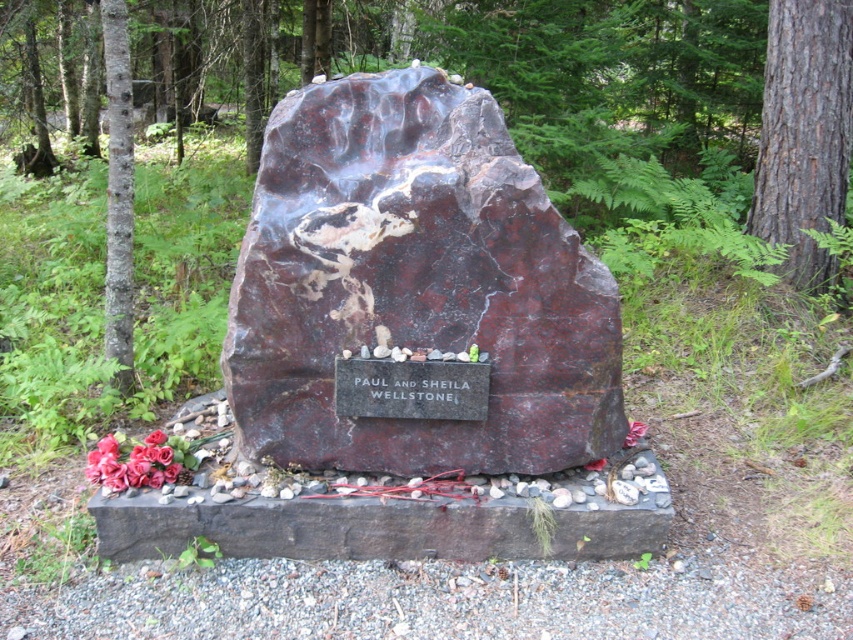
I want to click on marble-like stone at center, so click(415, 285).

What do you see at coordinates (415, 285) in the screenshot? I see `marble-like stone at center` at bounding box center [415, 285].

This screenshot has width=853, height=640. What are the coordinates of `marble-like stone at center` in the screenshot? It's located at (415, 285).

Which of these two, brown rough bark tree at right or brown rough bark tree at left, stands shorter?

brown rough bark tree at left

Consider the image. Is brown rough bark tree at right behind brown rough bark tree at left?

Yes, it is behind brown rough bark tree at left.

Between point (828, 216) and point (120, 108), which one is positioned in front?

Point (120, 108)

Locate an element on the screen. Image resolution: width=853 pixels, height=640 pixels. brown rough bark tree at right is located at coordinates (804, 132).

Is brown rough bark tree at left shorter than matte pink petals at lower left?

Incorrect, brown rough bark tree at left's height does not fall short of matte pink petals at lower left's.

Does brown rough bark tree at left have a greater height compared to matte pink petals at lower left?

Indeed, brown rough bark tree at left has a greater height compared to matte pink petals at lower left.

I want to click on brown rough bark tree at left, so click(x=119, y=193).